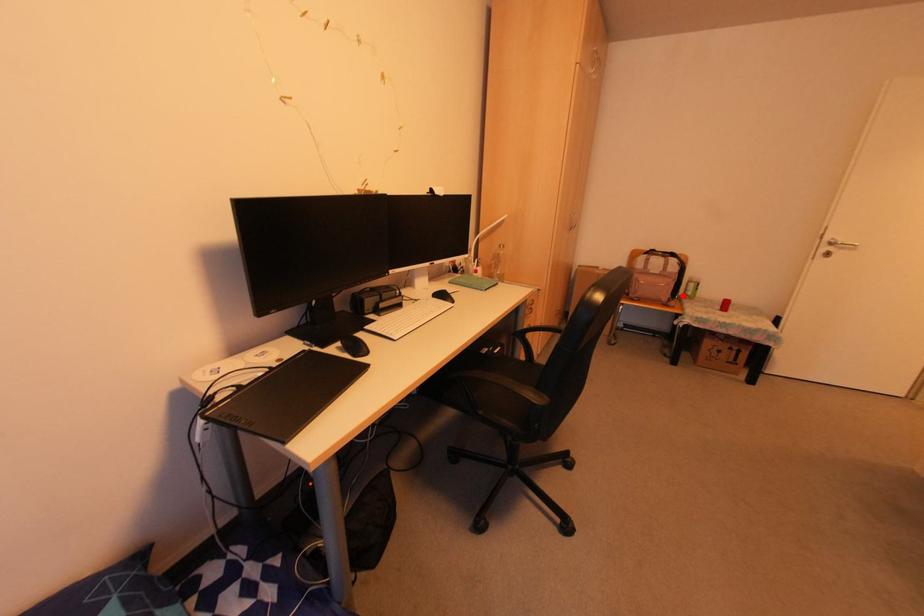
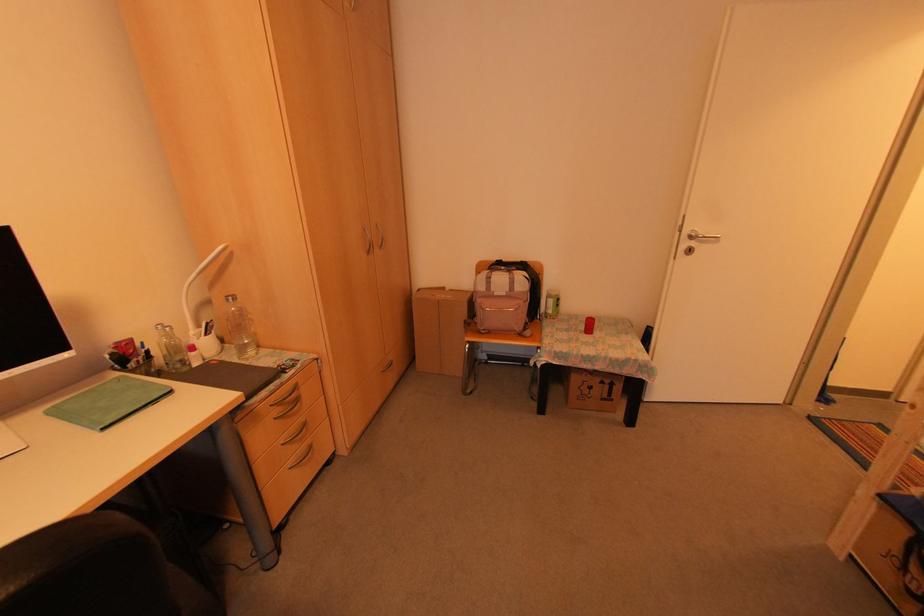
Question: I am providing you with two images of the same scene from different viewpoints. A red point is marked on the first image. Is the red point's position out of view in image 2?

Choices:
 (A) Yes
 (B) No

Answer: (B)